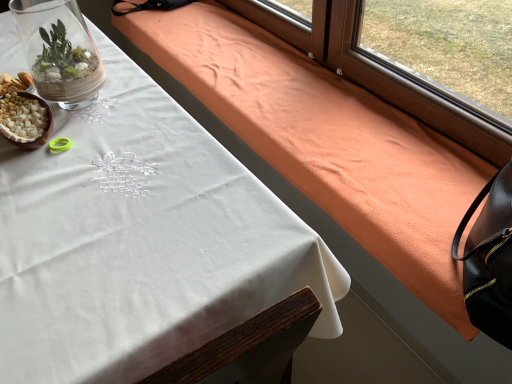
You are a GUI agent. You are given a task and a screenshot of the screen. Output one action in this format:
    pyautogui.click(x=<x>, y=<y>)
    Task: Click on the vacant area on top of white cloth at upper left (from a real-world perspective)
    The image size is (512, 384).
    Given the screenshot: What is the action you would take?
    pyautogui.click(x=88, y=184)